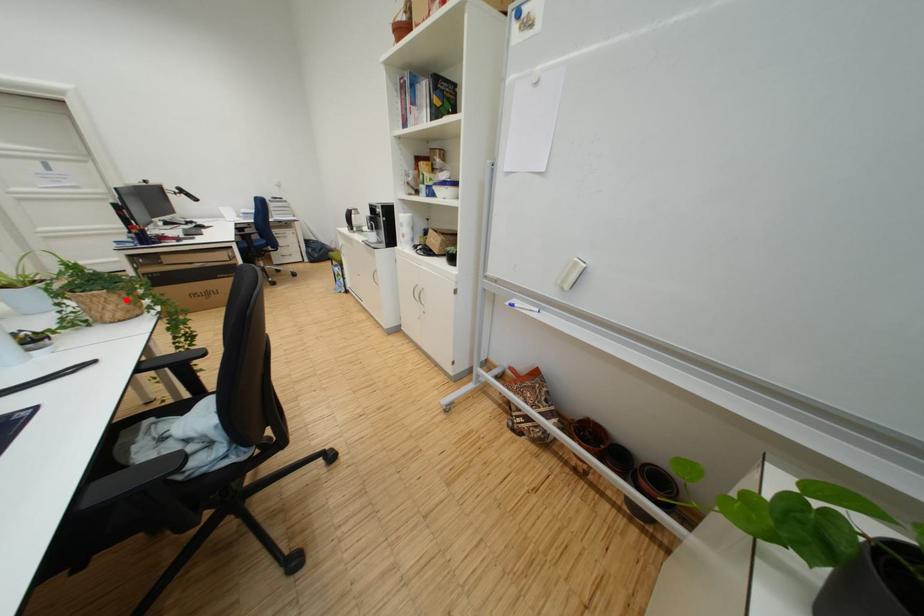
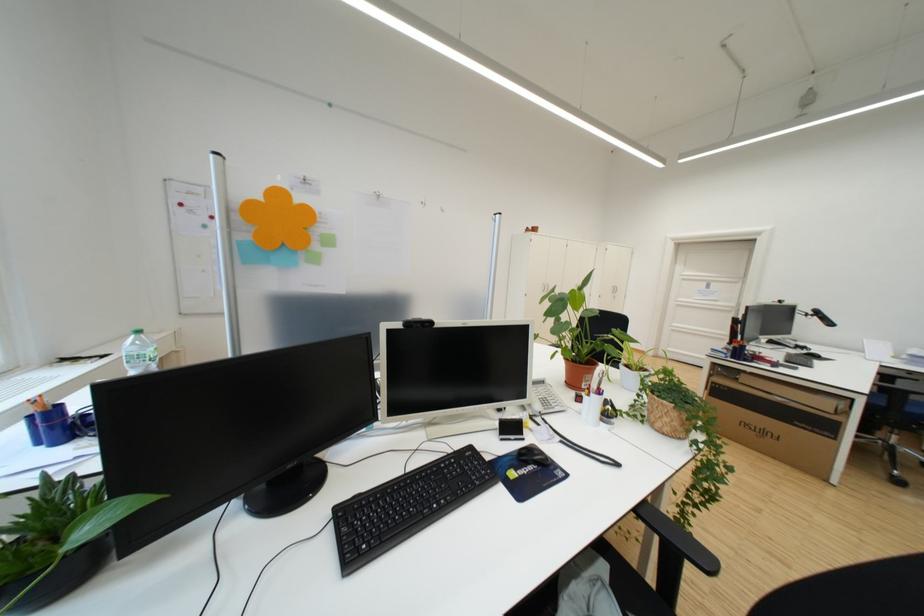
Where in the second image is the point corresponding to the highlighted location from the first image?

(687, 416)